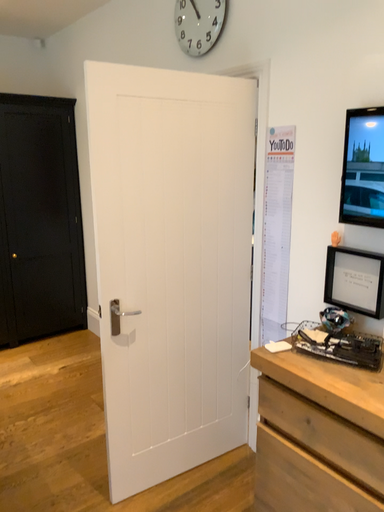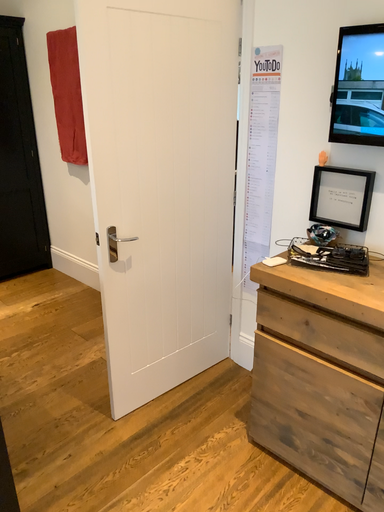
Question: How did the camera likely rotate when shooting the video?

Choices:
 (A) rotated downward
 (B) rotated upward

Answer: (A)